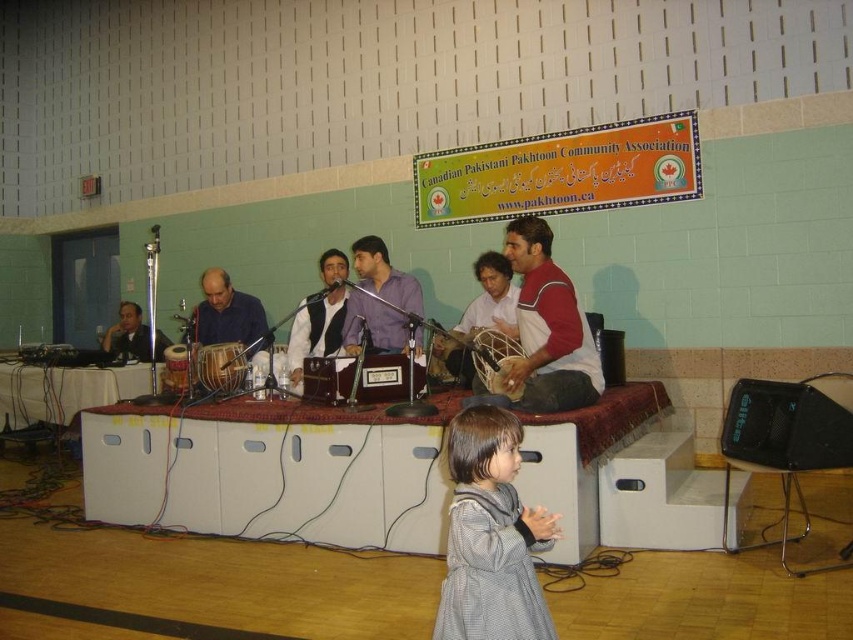
Which of these two, matte red and white shirt at center or wooden drum at center, stands shorter?

With less height is wooden drum at center.

From the picture: Can you confirm if matte red and white shirt at center is thinner than wooden drum at center?

Incorrect, matte red and white shirt at center's width is not less than wooden drum at center's.

The width and height of the screenshot is (853, 640). Find the location of `matte red and white shirt at center`. matte red and white shirt at center is located at coordinates (546, 330).

Which of these two, matte purple shirt at center or wooden drum at center, stands taller?

matte purple shirt at center

Which is in front, point (403, 320) or point (514, 394)?

Positioned in front is point (514, 394).

Who is more distant from viewer, (355,324) or (480,330)?

→ The point (355,324) is more distant.

This screenshot has height=640, width=853. In order to click on matte purple shirt at center in this screenshot , I will do `click(384, 275)`.

In the scene shown: Between matte red and white shirt at center and matte purple shirt at center, which one has less height?

matte purple shirt at center

Which is behind, point (576, 403) or point (389, 285)?

Point (389, 285)

Is point (538, 403) farther from camera compared to point (372, 305)?

No, (538, 403) is closer to viewer.

This screenshot has width=853, height=640. Identify the location of matte red and white shirt at center. (546, 330).